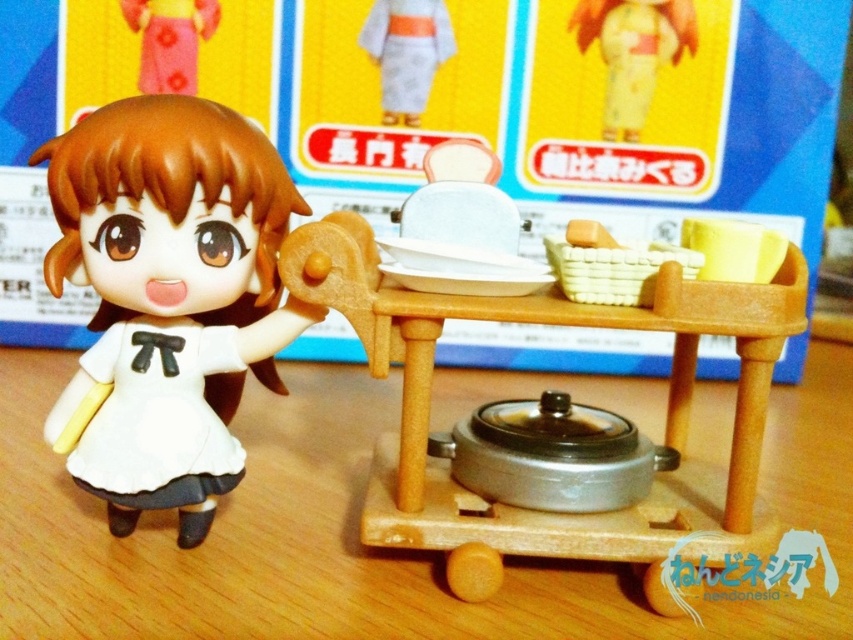
You are setting up a display for a toy store and need to place the white matte doll at left and the yellow matte cup at upper right on a shelf. The shelf has limited space between them. Based on their widths, do you think the space between them is sufficient if the shelf can only accommodate items up to the width of the wider object?

The white matte doll at left might be wider than the yellow matte cup at upper right, so the space between them may not be sufficient if the shelf can only accommodate items up to the width of the wider object.

You are taking a photo of the figurine and the kitchen set. Which point, point [195,371] or point [416,17], will appear larger in your photo?

Point [195,371] is closer to the camera than point [416,17], so it will appear larger in the photo.

In the image described, there is a white matte doll at left and a yellow matte cup at upper right. From the perspective of an observer looking at the scene, which object is positioned to the left of the other?

The white matte doll at left is positioned to the left of the yellow matte cup at upper right.